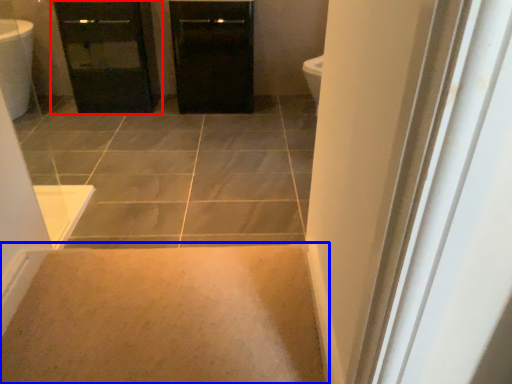
Question: Among these objects, which one is nearest to the camera, bathroom cabinet (highlighted by a red box) or plain (highlighted by a blue box)?

Choices:
 (A) bathroom cabinet
 (B) plain

Answer: (B)